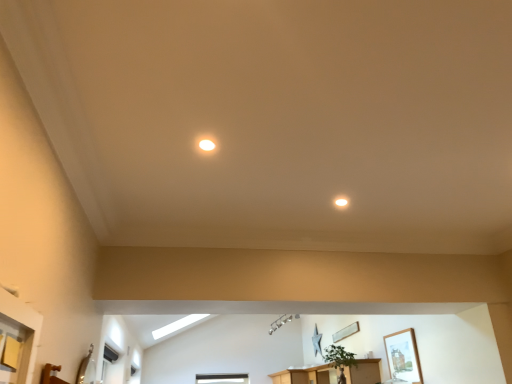
Question: Does wooden picture frame at center, placed as the 1th picture frame when sorted from left to right, turn towards green matte plant at center?

Choices:
 (A) yes
 (B) no

Answer: (B)

Question: From a real-world perspective, is wooden picture frame at center, which is counted as the 2th picture frame, starting from the front, below green matte plant at center?

Choices:
 (A) yes
 (B) no

Answer: (B)

Question: Considering the relative sizes of wooden picture frame at center, which is counted as the 2th picture frame, starting from the front, and green matte plant at center in the image provided, is wooden picture frame at center, which is counted as the 2th picture frame, starting from the front, smaller than green matte plant at center?

Choices:
 (A) yes
 (B) no

Answer: (A)

Question: From the image's perspective, is wooden picture frame at center, placed as the 1th picture frame when sorted from left to right, on top of green matte plant at center?

Choices:
 (A) no
 (B) yes

Answer: (A)

Question: Considering the relative positions of wooden picture frame at center, placed as the 1th picture frame when sorted from left to right, and green matte plant at center in the image provided, is wooden picture frame at center, placed as the 1th picture frame when sorted from left to right, to the right of green matte plant at center from the viewer's perspective?

Choices:
 (A) yes
 (B) no

Answer: (A)

Question: In the image, is matte white light fixture at upper center, arranged as the 2th lighting when viewed from the front, positioned in front of or behind wooden cabinet at lower center?

Choices:
 (A) front
 (B) behind

Answer: (A)

Question: From a real-world perspective, relative to wooden cabinet at lower center, is matte white light fixture at upper center, arranged as the 2th lighting when viewed from the front, vertically above or below?

Choices:
 (A) above
 (B) below

Answer: (A)

Question: Considering the positions of matte white light fixture at upper center, which is the second lighting in top-to-bottom order, and wooden cabinet at lower center in the image, is matte white light fixture at upper center, which is the second lighting in top-to-bottom order, wider or thinner than wooden cabinet at lower center?

Choices:
 (A) wide
 (B) thin

Answer: (B)

Question: From the image's perspective, is matte white light fixture at upper center, which is the second lighting in top-to-bottom order, positioned above or below wooden cabinet at lower center?

Choices:
 (A) above
 (B) below

Answer: (A)

Question: Do you think wooden framed picture at upper right, which appears as the 1th picture frame when viewed from the front, is within wooden cabinet at lower center, or outside of it?

Choices:
 (A) inside
 (B) outside

Answer: (B)

Question: From a real-world perspective, is wooden framed picture at upper right, which appears as the 1th picture frame when viewed from the front, above or below wooden cabinet at lower center?

Choices:
 (A) below
 (B) above

Answer: (B)

Question: In terms of width, does wooden framed picture at upper right, placed as the second picture frame when sorted from left to right, look wider or thinner when compared to wooden cabinet at lower center?

Choices:
 (A) wide
 (B) thin

Answer: (B)

Question: In terms of size, does wooden framed picture at upper right, which appears as the 1th picture frame when viewed from the front, appear bigger or smaller than wooden cabinet at lower center?

Choices:
 (A) big
 (B) small

Answer: (B)

Question: Is wooden framed picture at upper right, the 2th picture frame in the back-to-front sequence, wider or thinner than matte white light fixture at upper center, positioned as the first lighting in back-to-front order?

Choices:
 (A) thin
 (B) wide

Answer: (A)

Question: From a real-world perspective, is wooden framed picture at upper right, which appears as the 1th picture frame when viewed from the front, physically located above or below matte white light fixture at upper center, the 1th lighting in the right-to-left sequence?

Choices:
 (A) below
 (B) above

Answer: (A)